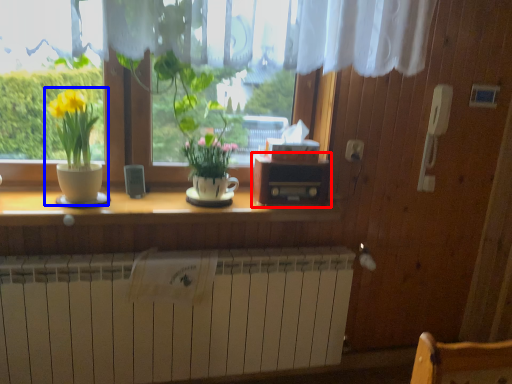
Question: Which object appears farthest to the camera in this image, window box (highlighted by a red box) or houseplant (highlighted by a blue box)?

Choices:
 (A) window box
 (B) houseplant

Answer: (A)